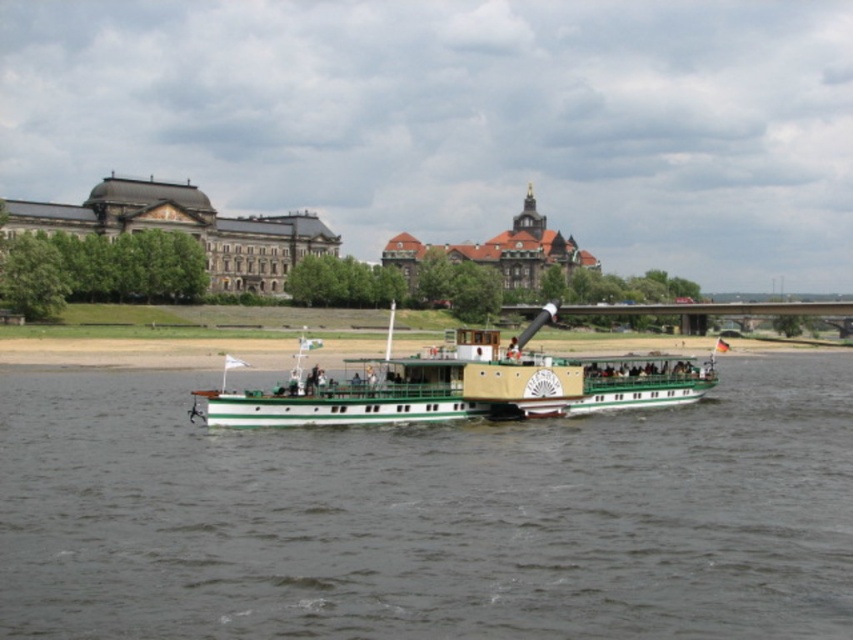
You are a photographer trying to capture both the green matte boat at center and the green polished wood boat at center in a single shot. Which boat will appear larger in your photo?

The green matte boat at center will appear larger in the photo because it is closer to the viewer than the green polished wood boat at center.

You are a tourist standing on the riverside and see both the green matte boat at center and the green polished wood boat at center. Which boat is positioned more to the left side?

The green matte boat at center is positioned more to the left side than the green polished wood boat at center.